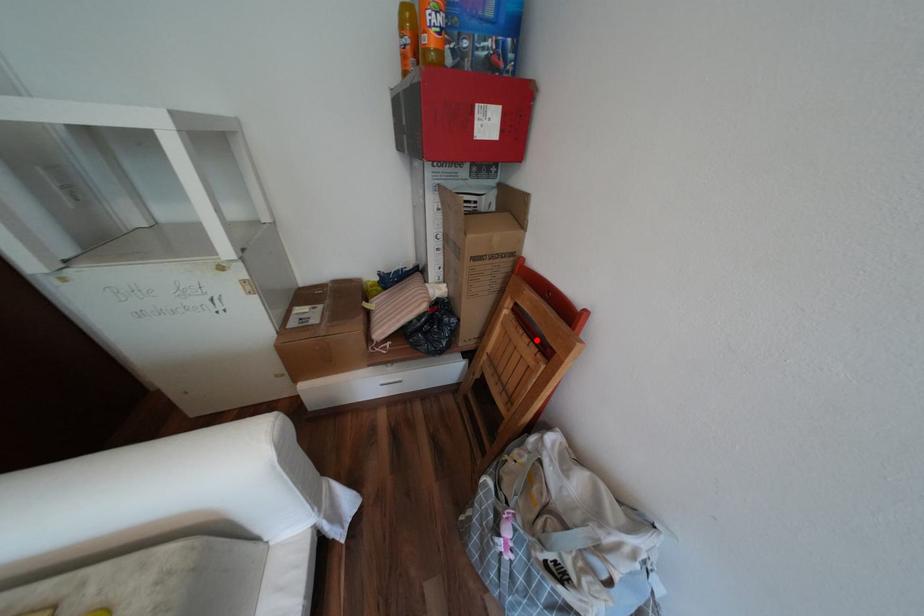
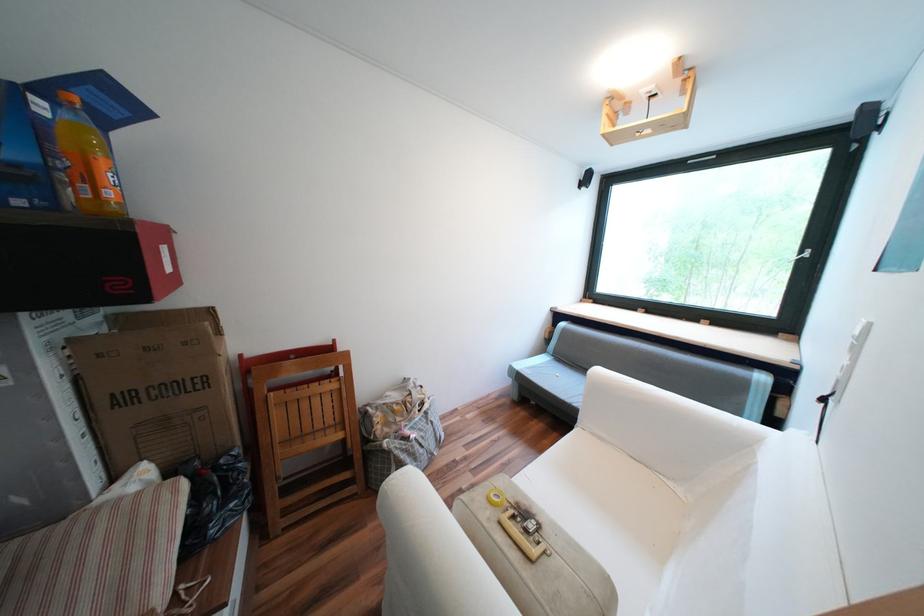
Find the pixel in the second image that matches the highlighted location in the first image.

(325, 383)